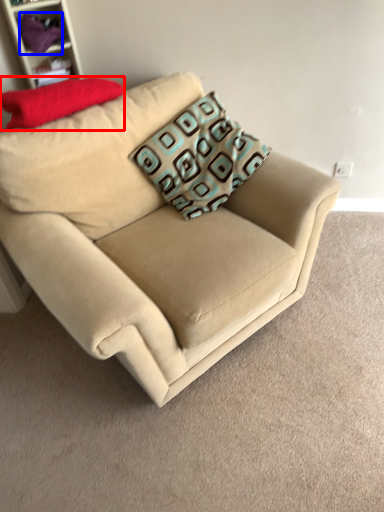
Question: Which point is closer to the camera, pillow (highlighted by a red box) or fabric (highlighted by a blue box)?

Choices:
 (A) pillow
 (B) fabric

Answer: (A)